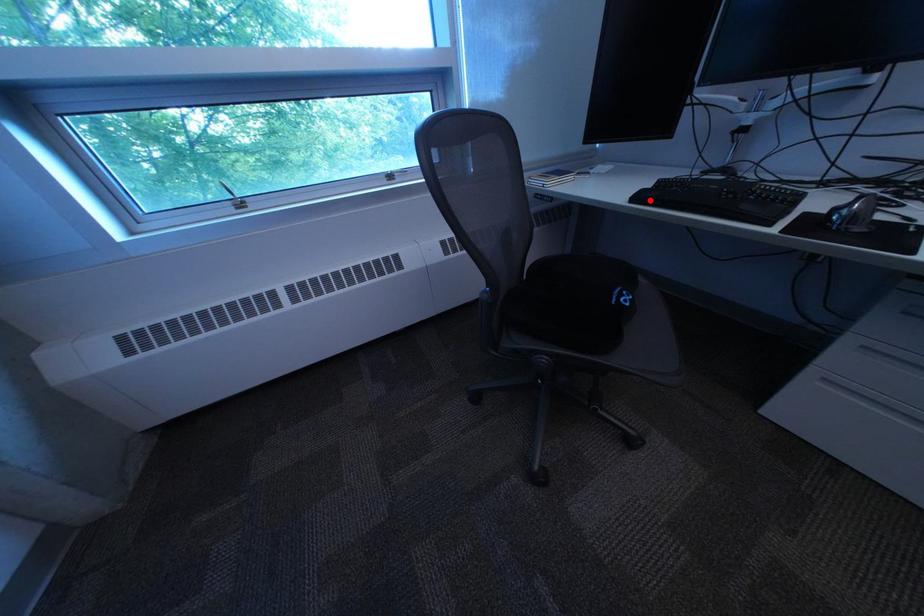
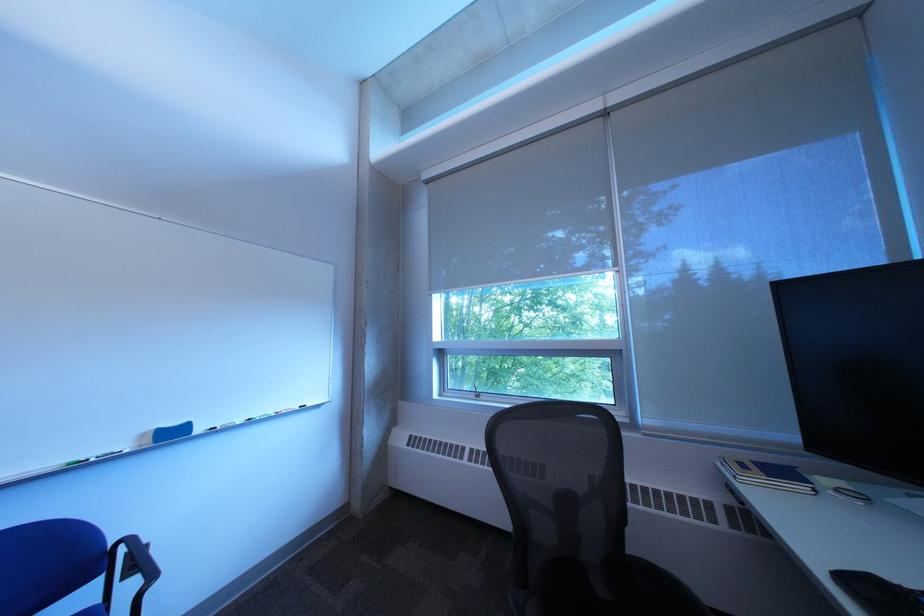
Find the pixel in the second image that matches the highlighted location in the first image.

(860, 582)